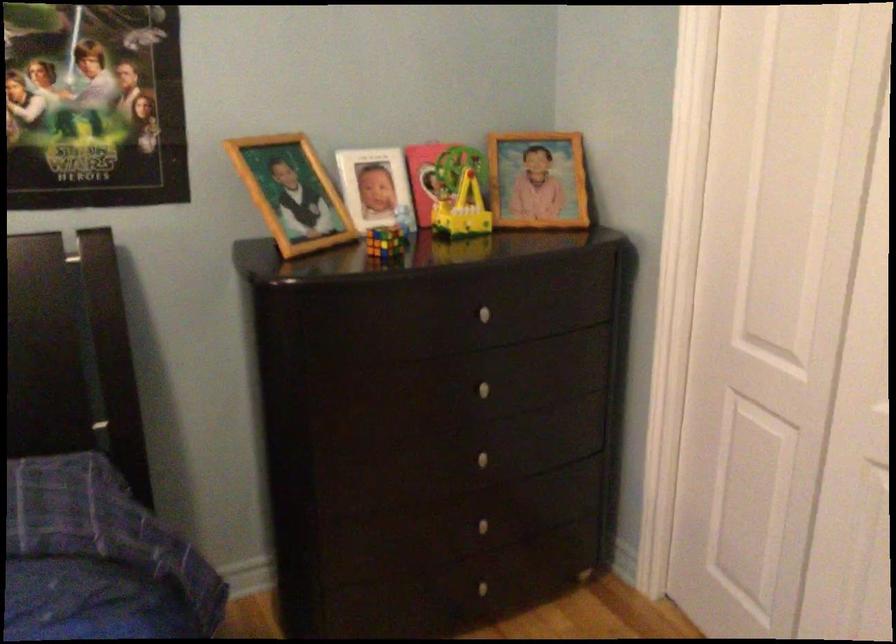
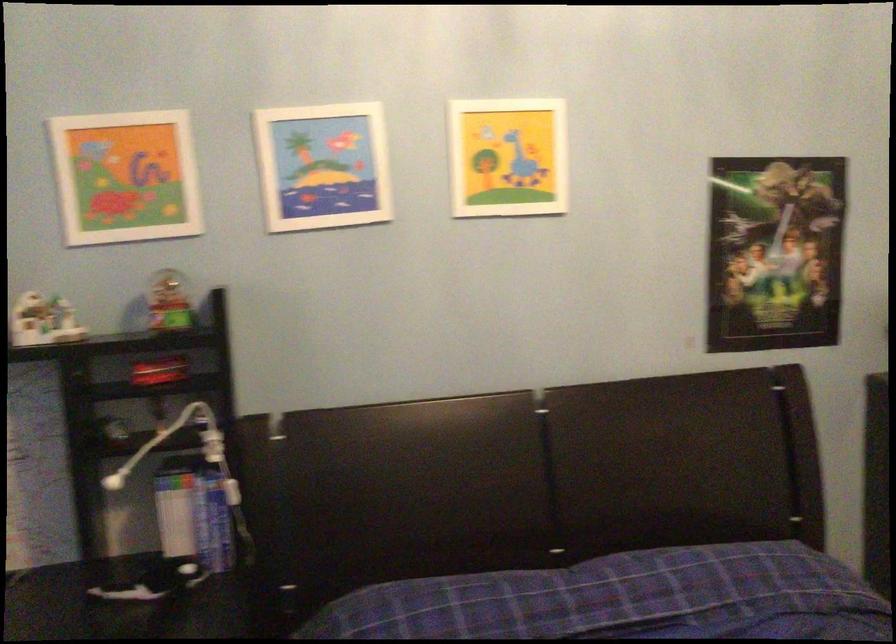
What movement of the cameraman would produce the second image?

The cameraman moved toward left, backward.